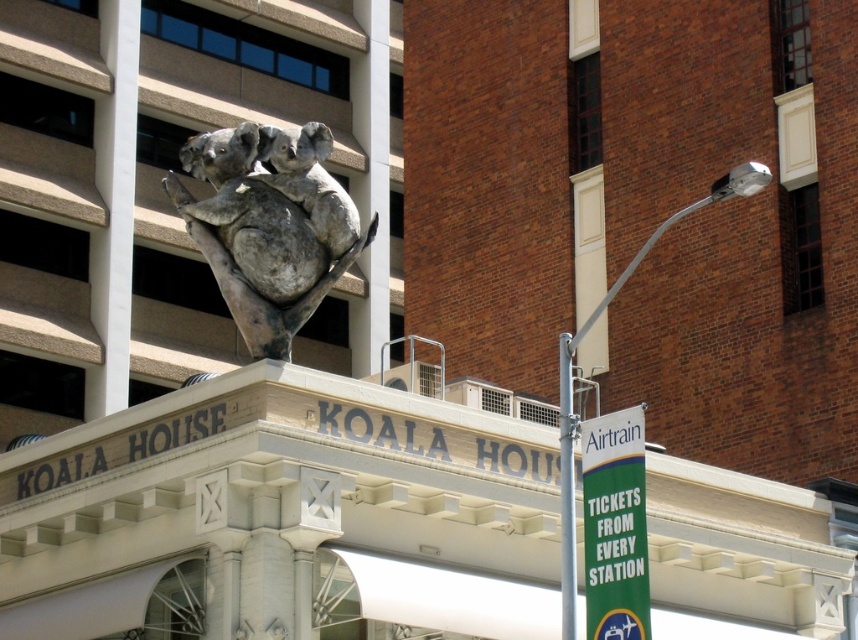
Question: Observing the image, what is the correct spatial positioning of gray stone koala at center in reference to green fabric banner at right?

Choices:
 (A) right
 (B) left

Answer: (B)

Question: Which of the following is the closest to the observer?

Choices:
 (A) white smooth pillar at upper left
 (B) metallic silver lamp post at upper right

Answer: (B)

Question: Can you confirm if gray stone koala at center is wider than green fabric banner at right?

Choices:
 (A) no
 (B) yes

Answer: (B)

Question: In this image, where is white smooth pillar at upper left located relative to green fabric banner at right?

Choices:
 (A) below
 (B) above

Answer: (B)

Question: Which point is farther from the camera taking this photo?

Choices:
 (A) [x=124, y=275]
 (B) [x=601, y=428]
 (C) [x=572, y=588]
 (D) [x=222, y=141]

Answer: (A)

Question: Among these points, which one is farthest from the camera?

Choices:
 (A) (560, 522)
 (B) (560, 481)

Answer: (A)